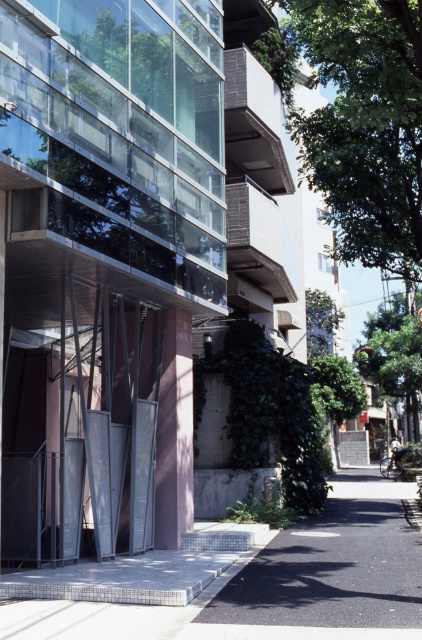
You are a delivery person trying to park your 15 feet long truck between the gray concrete pavement at lower center and the green leafy tree at center. Can you fit your truck there without hitting either object?

The distance between the gray concrete pavement at lower center and the green leafy tree at center is 24.36 feet. Since your truck is 15 feet long, there is enough space to park without hitting either object.